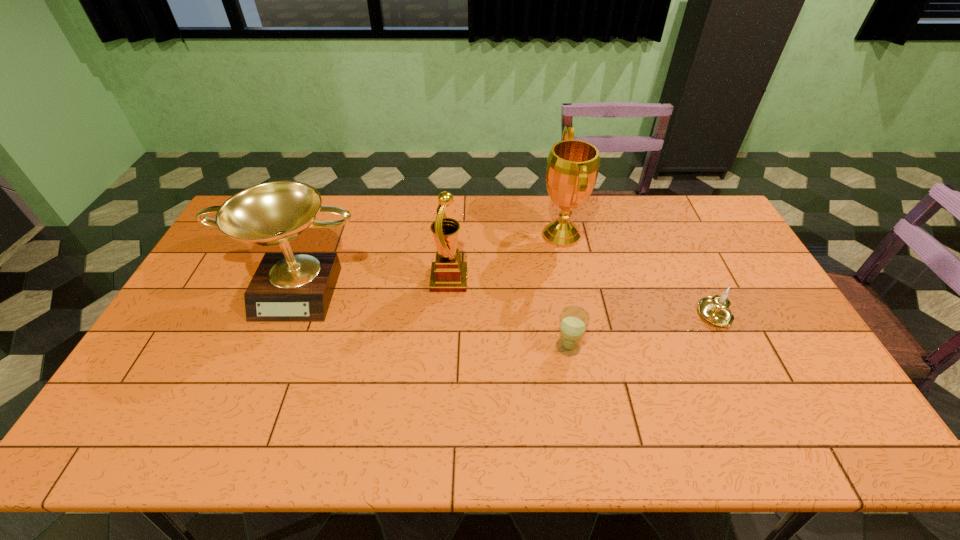
The width and height of the screenshot is (960, 540). What are the coordinates of `the rightmost award` in the screenshot? It's located at (572, 169).

I want to click on the second object from left to right, so click(448, 274).

Image resolution: width=960 pixels, height=540 pixels. I want to click on the leftmost object, so click(287, 287).

I want to click on the nearest object, so click(x=574, y=320).

I want to click on the rightmost object, so click(x=715, y=310).

Identify the location of vacant region located 0.170m on the front-facing side of the rightmost award. Image resolution: width=960 pixels, height=540 pixels. (490, 235).

The height and width of the screenshot is (540, 960). Find the location of `vacant point located 0.290m on the front-facing side of the rightmost award`. vacant point located 0.290m on the front-facing side of the rightmost award is located at coordinates (455, 235).

At what (x,y) coordinates should I click in order to perform the action: click on vacant space located on the front-facing side of the rightmost award. Please return your answer as a coordinate pair (x, y). This screenshot has height=540, width=960. Looking at the image, I should click on (469, 235).

I want to click on vacant region located 0.120m on the front-facing side of the second award from left to right, so click(x=506, y=280).

In order to click on free region located 0.170m on the front-facing side of the leftmost award in this screenshot , I will do [267, 373].